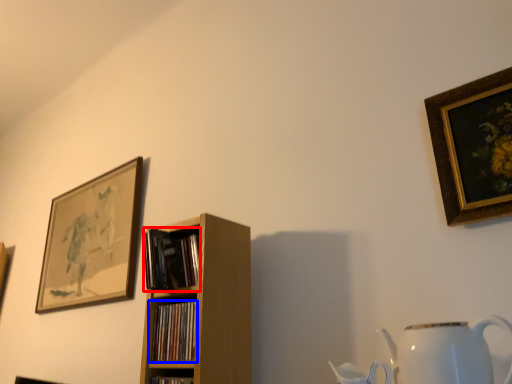
Question: Which of the following is the farthest to the observer, book (highlighted by a red box) or book (highlighted by a blue box)?

Choices:
 (A) book
 (B) book

Answer: (A)